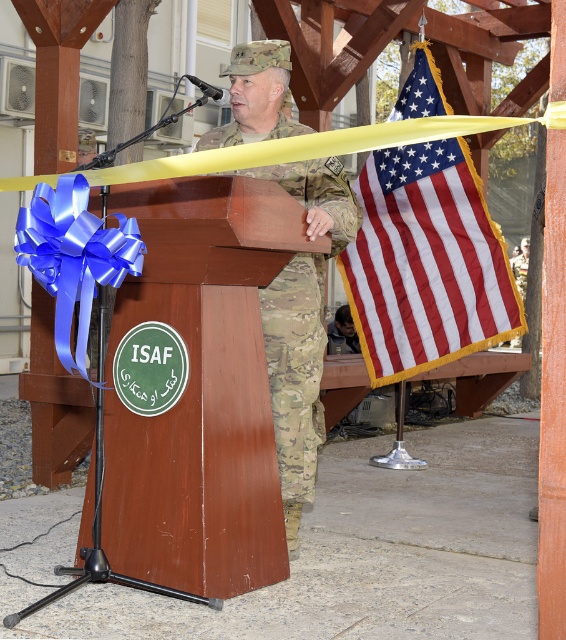
Question: Is the position of brown wood podium at center less distant than that of camouflage fabric uniform at center?

Choices:
 (A) no
 (B) yes

Answer: (B)

Question: Which object appears farthest from the camera in this image?

Choices:
 (A) red-white striped flag at upper right
 (B) brown wood podium at center
 (C) camouflage fabric uniform at center

Answer: (A)

Question: Which point is farther from the camera taking this photo?

Choices:
 (A) (118, 195)
 (B) (388, 177)

Answer: (B)

Question: Does red-white striped flag at upper right appear on the right side of blue satin ribbon at left?

Choices:
 (A) yes
 (B) no

Answer: (A)

Question: Which of the following is the closest to the observer?

Choices:
 (A) (302, 298)
 (B) (512, 307)
 (C) (239, 508)
 (D) (95, 272)

Answer: (D)

Question: Observing the image, what is the correct spatial positioning of red-white striped flag at upper right in reference to blue satin ribbon at left?

Choices:
 (A) above
 (B) below

Answer: (A)